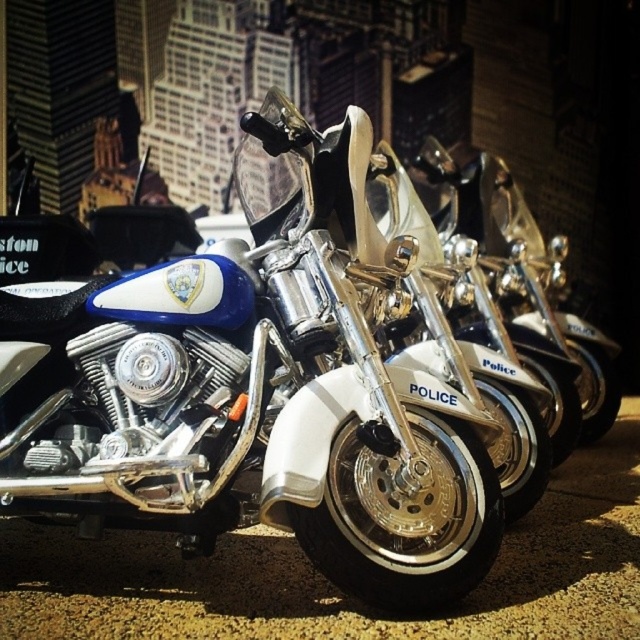
Question: Which point appears farthest from the camera in this image?

Choices:
 (A) click(x=198, y=627)
 (B) click(x=330, y=221)

Answer: (B)

Question: Is white glossy police motorcycle at center to the left of black asphalt pavement at center from the viewer's perspective?

Choices:
 (A) no
 (B) yes

Answer: (B)

Question: Can you confirm if white glossy police motorcycle at center is smaller than black asphalt pavement at center?

Choices:
 (A) yes
 (B) no

Answer: (A)

Question: Is white glossy police motorcycle at center bigger than black asphalt pavement at center?

Choices:
 (A) yes
 (B) no

Answer: (B)

Question: Which point appears closest to the camera in this image?

Choices:
 (A) (481, 627)
 (B) (131, 362)

Answer: (A)